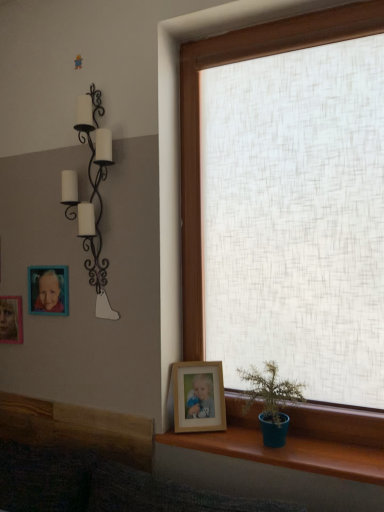
Where is `matte plastic picture frame at upper left, arranged as the 2th picture frame when viewed from the front`? This screenshot has height=512, width=384. matte plastic picture frame at upper left, arranged as the 2th picture frame when viewed from the front is located at coordinates (48, 290).

Image resolution: width=384 pixels, height=512 pixels. Describe the element at coordinates (299, 439) in the screenshot. I see `teak wood window sill at lower right` at that location.

At what (x,y) coordinates should I click in order to perform the action: click on matte plastic picture frame at upper left, placed as the third picture frame when sorted from bottom to top. Please return your answer as a coordinate pair (x, y). This screenshot has width=384, height=512. Looking at the image, I should click on (48, 290).

Is wooden photo frame at lower center, the third picture frame from the left, in front of or behind teak wood window sill at lower right in the image?

In the image, wooden photo frame at lower center, the third picture frame from the left, appears behind teak wood window sill at lower right.

Is wooden photo frame at lower center, which ranks as the third picture frame in top-to-bottom order, thinner than teak wood window sill at lower right?

Yes, wooden photo frame at lower center, which ranks as the third picture frame in top-to-bottom order, is thinner than teak wood window sill at lower right.

From a real-world perspective, is wooden photo frame at lower center, which is counted as the first picture frame, starting from the front, positioned under teak wood window sill at lower right based on gravity?

No, from a real-world perspective, wooden photo frame at lower center, which is counted as the first picture frame, starting from the front, is not under teak wood window sill at lower right.

The width and height of the screenshot is (384, 512). Identify the location of window sill in front of the wooden photo frame at lower center, which ranks as the third picture frame in top-to-bottom order. (299, 439).

Is black wrought iron candle holder at upper left positioned behind wooden photo frame at left, the third picture frame when ordered from front to back?

That is False.

From the image's perspective, who appears lower, black wrought iron candle holder at upper left or wooden photo frame at left, positioned as the second picture frame in top-to-bottom order?

wooden photo frame at left, positioned as the second picture frame in top-to-bottom order.

Would you say black wrought iron candle holder at upper left is a long distance from wooden photo frame at left, which is the first picture frame in left-to-right order?

They are positioned close to each other.

Looking at this image, is wooden photo frame at lower center, placed as the 1th picture frame when sorted from right to left, positioned in front of black wrought iron candle holder at upper left?

No, wooden photo frame at lower center, placed as the 1th picture frame when sorted from right to left, is further to the viewer.

Is wooden photo frame at lower center, the third picture frame from the left, aimed at black wrought iron candle holder at upper left?

No, wooden photo frame at lower center, the third picture frame from the left, is not oriented towards black wrought iron candle holder at upper left.

Considering the sizes of objects wooden photo frame at lower center, which ranks as the third picture frame in back-to-front order, and black wrought iron candle holder at upper left in the image provided, who is bigger, wooden photo frame at lower center, which ranks as the third picture frame in back-to-front order, or black wrought iron candle holder at upper left?

Bigger between the two is black wrought iron candle holder at upper left.

Are wooden photo frame at lower center, the third picture frame from the left, and black wrought iron candle holder at upper left making contact?

No.

Locate an element on the screen. houseplant that appears below the matte plastic picture frame at upper left, the second picture frame from the back (from the image's perspective) is located at coordinates (270, 401).

Are teal ceramic pot at lower right and matte plastic picture frame at upper left, placed as the third picture frame when sorted from bottom to top, located far from each other?

teal ceramic pot at lower right is actually quite close to matte plastic picture frame at upper left, placed as the third picture frame when sorted from bottom to top.

Is point (299, 385) positioned behind point (36, 306)?

No, it is in front of (36, 306).

From the image's perspective, who appears lower, teal ceramic pot at lower right or matte plastic picture frame at upper left, the 2th picture frame positioned from the right?

teal ceramic pot at lower right, from the image's perspective.

Is teal ceramic pot at lower right to the left of wooden photo frame at lower center, placed as the 1th picture frame when sorted from bottom to top, from the viewer's perspective?

In fact, teal ceramic pot at lower right is to the right of wooden photo frame at lower center, placed as the 1th picture frame when sorted from bottom to top.

Does teal ceramic pot at lower right turn towards wooden photo frame at lower center, placed as the 1th picture frame when sorted from bottom to top?

No, teal ceramic pot at lower right is not turned towards wooden photo frame at lower center, placed as the 1th picture frame when sorted from bottom to top.

From a real-world perspective, is teal ceramic pot at lower right beneath wooden photo frame at lower center, which ranks as the third picture frame in top-to-bottom order?

No, from a real-world perspective, teal ceramic pot at lower right is not below wooden photo frame at lower center, which ranks as the third picture frame in top-to-bottom order.

Is point (262, 399) more distant than point (174, 394)?

No, (262, 399) is closer to viewer.

Does matte plastic picture frame at upper left, the second picture frame from the back, appear on the left side of teal ceramic pot at lower right?

Yes.

Considering the relative sizes of matte plastic picture frame at upper left, the second picture frame from the back, and teal ceramic pot at lower right in the image provided, is matte plastic picture frame at upper left, the second picture frame from the back, wider than teal ceramic pot at lower right?

Incorrect, the width of matte plastic picture frame at upper left, the second picture frame from the back, does not surpass that of teal ceramic pot at lower right.

Where is `lamp above the teal ceramic pot at lower right (from the image's perspective)`? lamp above the teal ceramic pot at lower right (from the image's perspective) is located at coordinates (91, 195).

Could you tell me if teal ceramic pot at lower right is turned towards black wrought iron candle holder at upper left?

No, teal ceramic pot at lower right is not oriented towards black wrought iron candle holder at upper left.

From the image's perspective, is teal ceramic pot at lower right located beneath black wrought iron candle holder at upper left?

Indeed, from the image's perspective, teal ceramic pot at lower right is shown beneath black wrought iron candle holder at upper left.

Measure the distance between teal ceramic pot at lower right and black wrought iron candle holder at upper left.

A distance of 32.32 inches exists between teal ceramic pot at lower right and black wrought iron candle holder at upper left.

Find the location of a particular element. The image size is (384, 512). window sill that is below the wooden photo frame at lower center, which ranks as the third picture frame in top-to-bottom order (from the image's perspective) is located at coordinates click(299, 439).

Locate an element on the screen. The width and height of the screenshot is (384, 512). the 2nd picture frame to the left of the black wrought iron candle holder at upper left, starting your count from the anchor is located at coordinates click(x=11, y=319).

Which object lies further to the anchor point teak wood window sill at lower right, teal ceramic pot at lower right or wooden photo frame at lower center, which ranks as the third picture frame in top-to-bottom order?

wooden photo frame at lower center, which ranks as the third picture frame in top-to-bottom order, is further to teak wood window sill at lower right.

When comparing their distances from teak wood window sill at lower right, does wooden photo frame at left, positioned as the second picture frame in top-to-bottom order, or matte plastic picture frame at upper left, placed as the third picture frame when sorted from bottom to top, seem closer?

matte plastic picture frame at upper left, placed as the third picture frame when sorted from bottom to top, is closer to teak wood window sill at lower right.

Which object lies further to the anchor point teal ceramic pot at lower right, matte plastic picture frame at upper left, the second picture frame from the back, or wooden photo frame at left, which is the first picture frame in left-to-right order?

Based on the image, wooden photo frame at left, which is the first picture frame in left-to-right order, appears to be further to teal ceramic pot at lower right.

From the image, which object appears to be farther from wooden photo frame at left, the third picture frame when ordered from front to back, matte plastic picture frame at upper left, arranged as the 2th picture frame when viewed from the front, or wooden photo frame at lower center, placed as the 1th picture frame when sorted from bottom to top?

Based on the image, wooden photo frame at lower center, placed as the 1th picture frame when sorted from bottom to top, appears to be further to wooden photo frame at left, the third picture frame when ordered from front to back.

When comparing their distances from matte plastic picture frame at upper left, the second picture frame from the back, does teak wood window sill at lower right or wooden photo frame at lower center, which ranks as the third picture frame in top-to-bottom order, seem further?

Among the two, teak wood window sill at lower right is located further to matte plastic picture frame at upper left, the second picture frame from the back.

Consider the image. From the image, which object appears to be farther from wooden photo frame at lower center, which ranks as the third picture frame in back-to-front order, teak wood window sill at lower right or black wrought iron candle holder at upper left?

black wrought iron candle holder at upper left.

Considering their positions, is wooden photo frame at lower center, which is counted as the first picture frame, starting from the front, positioned closer to teak wood window sill at lower right than black wrought iron candle holder at upper left?

Based on the image, wooden photo frame at lower center, which is counted as the first picture frame, starting from the front, appears to be nearer to teak wood window sill at lower right.

Based on their spatial positions, is wooden photo frame at lower center, the third picture frame from the left, or wooden photo frame at left, which is the first picture frame in left-to-right order, further from teal ceramic pot at lower right?

The object further to teal ceramic pot at lower right is wooden photo frame at left, which is the first picture frame in left-to-right order.

The width and height of the screenshot is (384, 512). I want to click on houseplant between teak wood window sill at lower right and wooden photo frame at lower center, which is counted as the first picture frame, starting from the front, along the z-axis, so click(270, 401).

I want to click on picture frame between matte plastic picture frame at upper left, placed as the third picture frame when sorted from bottom to top, and teal ceramic pot at lower right, in the horizontal direction, so click(x=198, y=397).

Find the location of `houseplant between matte plastic picture frame at upper left, arranged as the 2th picture frame when viewed from the front, and teak wood window sill at lower right, in the horizontal direction`. houseplant between matte plastic picture frame at upper left, arranged as the 2th picture frame when viewed from the front, and teak wood window sill at lower right, in the horizontal direction is located at coordinates (270, 401).

Locate an element on the screen. This screenshot has height=512, width=384. houseplant between wooden photo frame at left, positioned as the second picture frame in top-to-bottom order, and teak wood window sill at lower right, in the horizontal direction is located at coordinates (270, 401).